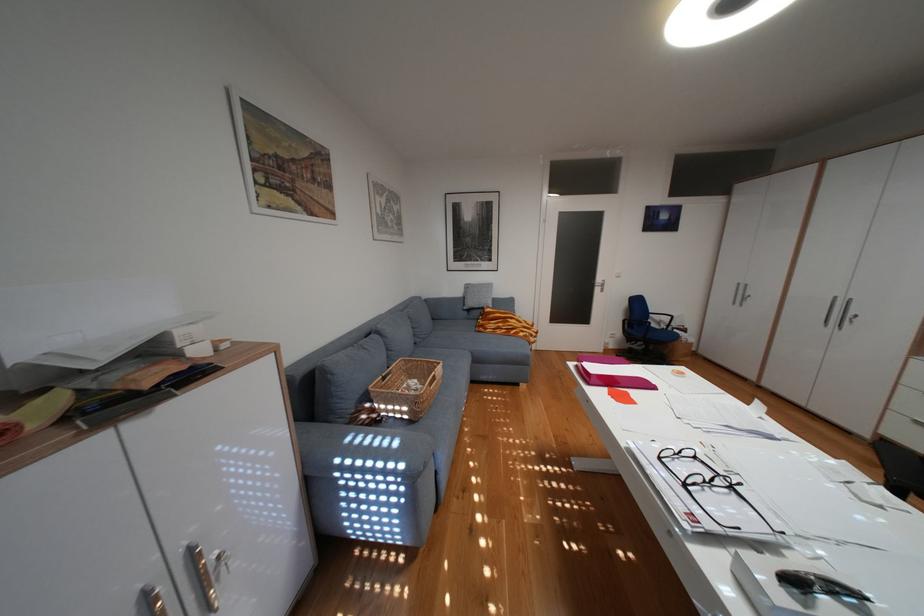
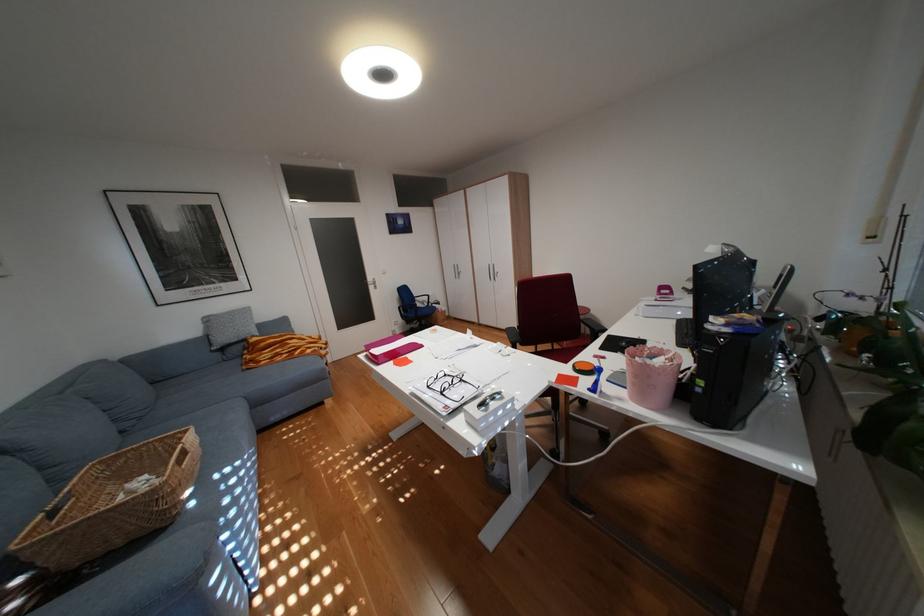
Where in the second image is the point corresponding to (698,485) from the first image?

(454, 392)